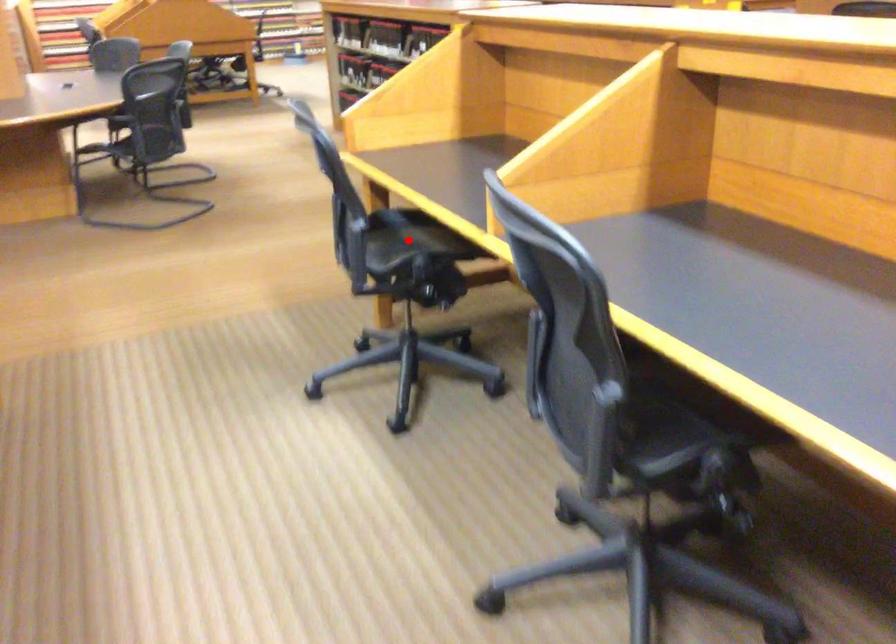
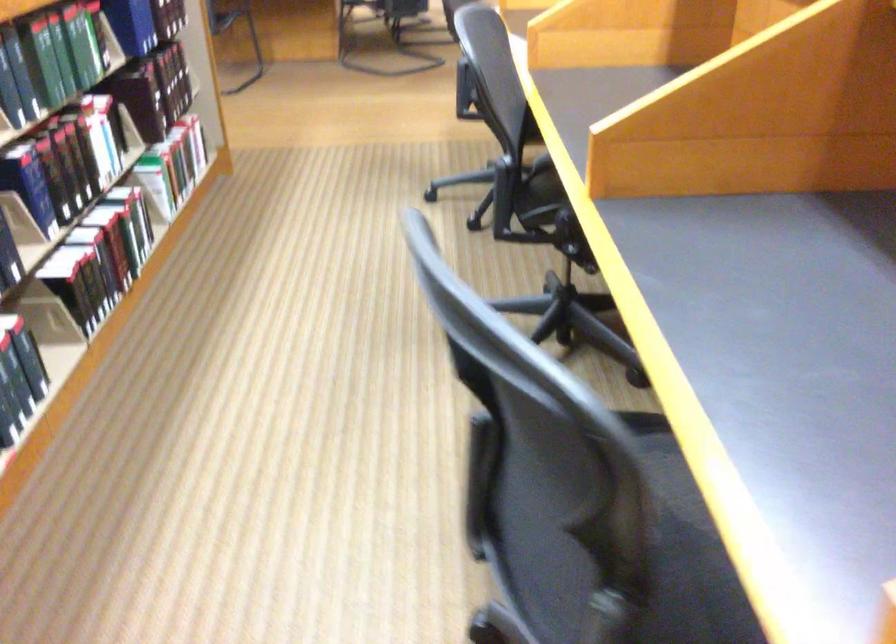
Question: I am providing you with two images of the same scene from different viewpoints. A red point is marked on the first image. Can you still see the location of the red point in image 2?

Choices:
 (A) Yes
 (B) No

Answer: (B)